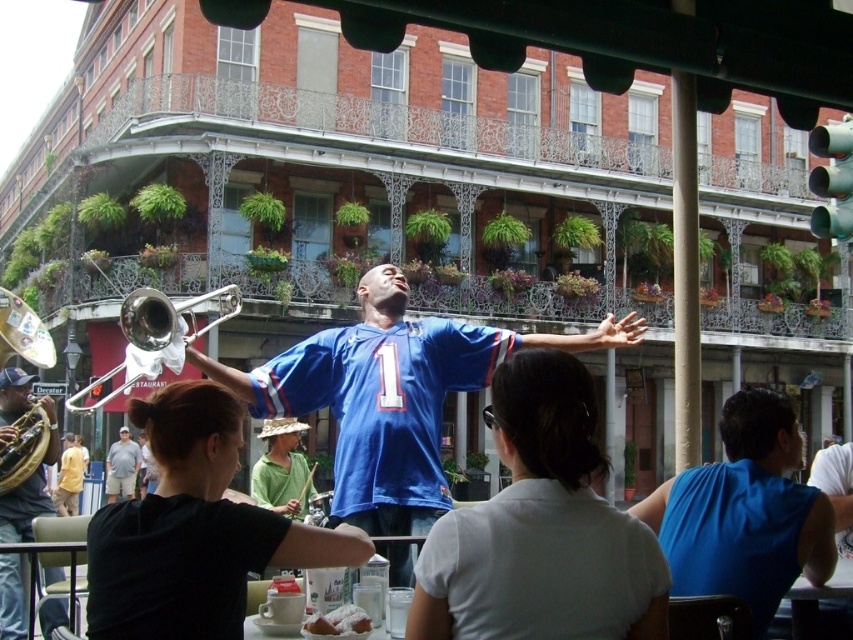
You are a photographer trying to capture a photo of the shiny brass trumpet at left and the yellow cotton shirt at lower left. Based on their positions, which object should you focus on first to ensure both are in the frame?

The shiny brass trumpet at left is located above the yellow cotton shirt at lower left, so you should focus on the shiny brass trumpet at left first to ensure both are in the frame.

From the picture: You are a photographer standing at the edge of the crowd. You want to take a photo of the blue jersey at center and khaki shorts at lower left in the same frame. Given that your camera has a maximum zoom range of 20 meters, will you be able to capture both subjects in one shot?

The distance between the blue jersey at center and khaki shorts at lower left is 26.00 meters. Since the camera can only zoom up to 20 meters, it won cannot capture both subjects in one shot without moving closer.

You are a photographer trying to capture a shot of the shiny brass trumpet at left and the yellow cotton shirt at lower left. Which object should you focus on first if you want to include both in your frame without moving the camera?

The shiny brass trumpet at left is positioned on the right side of yellow cotton shirt at lower left, so you should focus on the yellow cotton shirt at lower left first to ensure both are in frame.